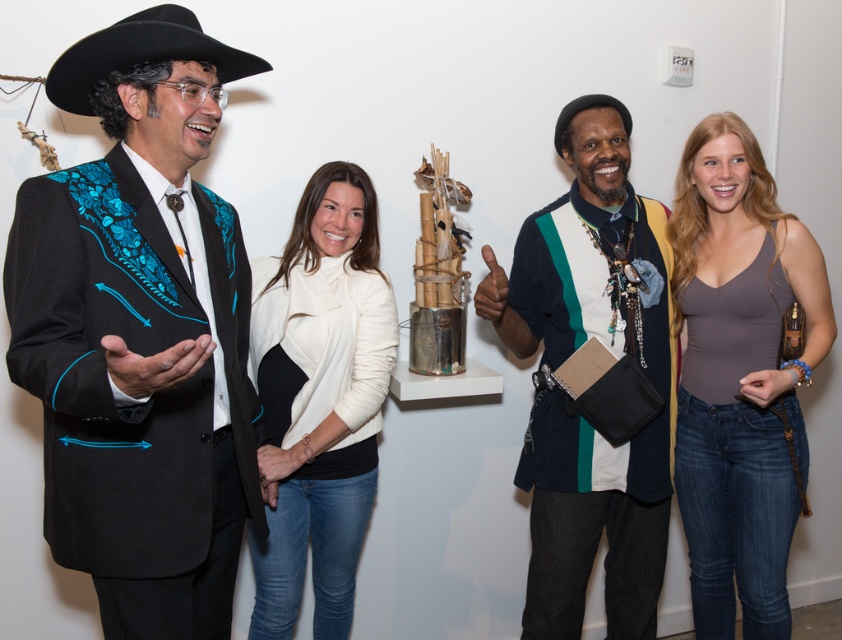
Does matte black suit at left appear over matte gray tank top at right?

Yes, matte black suit at left is above matte gray tank top at right.

Who is positioned more to the left, matte black suit at left or matte gray tank top at right?

matte black suit at left is more to the left.

This screenshot has width=842, height=640. What do you see at coordinates (140, 332) in the screenshot? I see `matte black suit at left` at bounding box center [140, 332].

Locate an element on the screen. Image resolution: width=842 pixels, height=640 pixels. matte black suit at left is located at coordinates (140, 332).

Is point (709, 548) farther from camera compared to point (126, 29)?

Yes, point (709, 548) is farther from viewer.

Which is below, matte gray tank top at right or black felt cowboy hat at upper left?

matte gray tank top at right

Is point (743, 252) farther from viewer compared to point (153, 28)?

That is True.

Find the location of a particular element. matte gray tank top at right is located at coordinates (739, 376).

Consider the image. Which is below, matte black suit at left or black felt cowboy hat at upper left?

matte black suit at left is below.

Which is more to the right, matte black suit at left or black felt cowboy hat at upper left?

matte black suit at left is more to the right.

Is point (22, 262) farther from viewer compared to point (131, 67)?

No, it is in front of (131, 67).

Where is `matte black suit at left`? matte black suit at left is located at coordinates (140, 332).